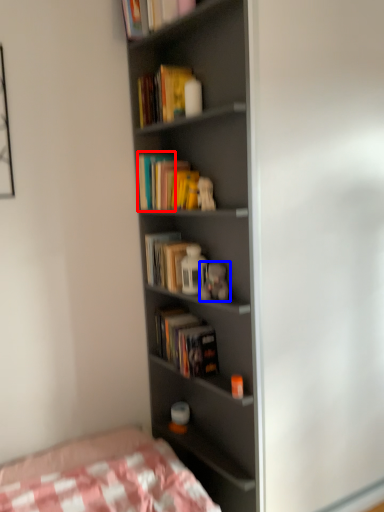
Question: Which of the following is the closest to the observer, paperback book (highlighted by a red box) or toy (highlighted by a blue box)?

Choices:
 (A) paperback book
 (B) toy

Answer: (B)